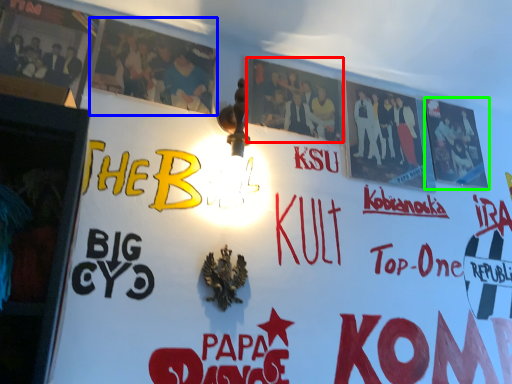
Question: Considering the real-world distances, which object is farthest from poster (highlighted by a red box)? poster (highlighted by a blue box) or poster (highlighted by a green box)?

Choices:
 (A) poster
 (B) poster

Answer: (B)